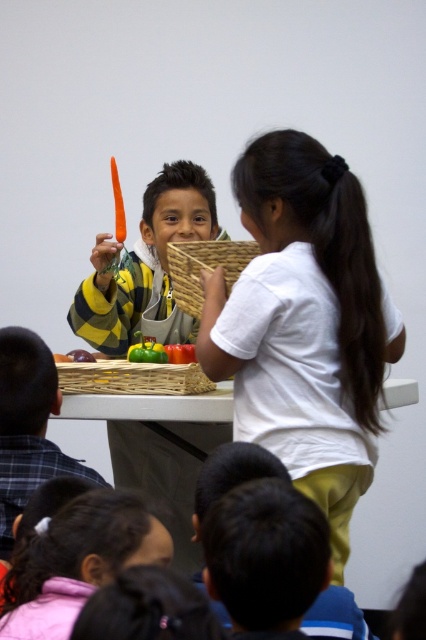
Is green matte bell pepper at center shorter than green matte pepper at center?

No, green matte bell pepper at center is not shorter than green matte pepper at center.

Between green matte bell pepper at center and green matte pepper at center, which one has less height?

With less height is green matte pepper at center.

Describe the element at coordinates (146, 349) in the screenshot. The width and height of the screenshot is (426, 640). I see `green matte bell pepper at center` at that location.

Find the location of a particular element. green matte bell pepper at center is located at coordinates click(146, 349).

The width and height of the screenshot is (426, 640). What do you see at coordinates (204, 268) in the screenshot? I see `woven brown basket at center` at bounding box center [204, 268].

Is woven brown basket at center wider than orange matte carrot at upper center?

Yes, woven brown basket at center is wider than orange matte carrot at upper center.

At what (x,y) coordinates should I click in order to perform the action: click on woven brown basket at center. Please return your answer as a coordinate pair (x, y). The height and width of the screenshot is (640, 426). Looking at the image, I should click on (204, 268).

Who is positioned more to the left, woven bamboo tray at center or woven brown basket at center?

Positioned to the left is woven bamboo tray at center.

Measure the distance from woven bamboo tray at center to woven brown basket at center.

A distance of 38.05 centimeters exists between woven bamboo tray at center and woven brown basket at center.

What do you see at coordinates (132, 378) in the screenshot?
I see `woven bamboo tray at center` at bounding box center [132, 378].

I want to click on woven bamboo tray at center, so click(x=132, y=378).